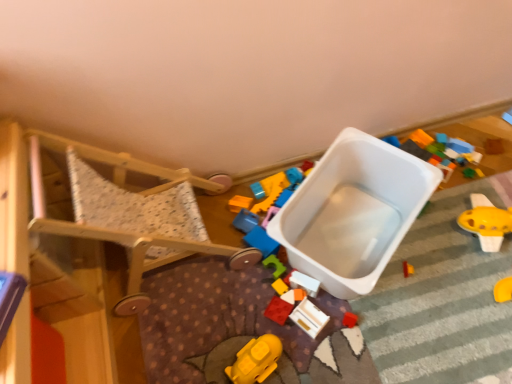
Where is `vacant space to the right of rubber yellow toy at center, placed as the fourth toy when sorted from right to left`? This screenshot has height=384, width=512. vacant space to the right of rubber yellow toy at center, placed as the fourth toy when sorted from right to left is located at coordinates (334, 270).